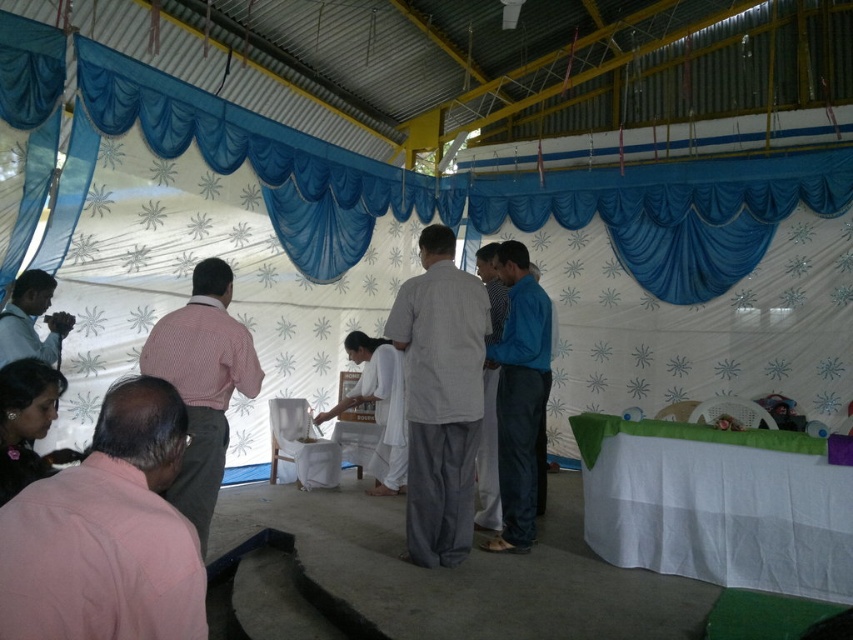
Question: Can you confirm if light gray cotton shirt at center is positioned above blue cotton shirt at center?

Choices:
 (A) no
 (B) yes

Answer: (B)

Question: Which point is closer to the camera taking this photo?

Choices:
 (A) (523, 451)
 (B) (7, 305)

Answer: (B)

Question: In this image, where is pink cotton shirt at lower left located relative to light gray cotton shirt at center?

Choices:
 (A) right
 (B) left

Answer: (B)

Question: Estimate the real-world distances between objects in this image. Which object is farther from the matte black camera at left?

Choices:
 (A) pink cotton shirt at lower left
 (B) pink checkered shirt at left

Answer: (A)

Question: Which of these objects is positioned farthest from the matte black camera at left?

Choices:
 (A) pink checkered shirt at left
 (B) pink cotton shirt at lower left
 (C) blue cotton shirt at center
 (D) light gray cotton shirt at center

Answer: (C)

Question: Is light gray cotton shirt at center bigger than matte black camera at left?

Choices:
 (A) no
 (B) yes

Answer: (B)